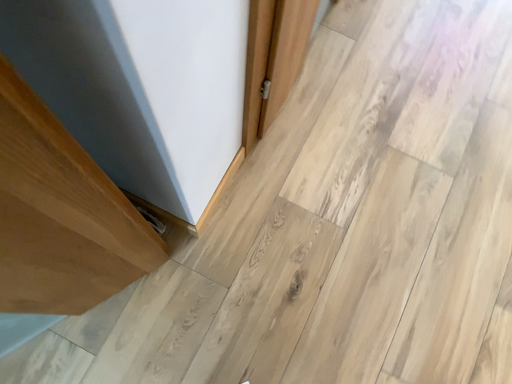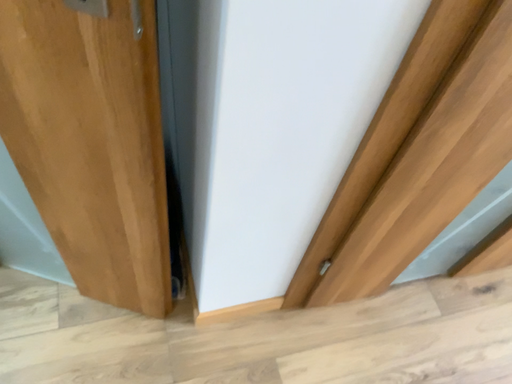
Question: How did the camera likely rotate when shooting the video?

Choices:
 (A) rotated right
 (B) rotated left

Answer: (B)